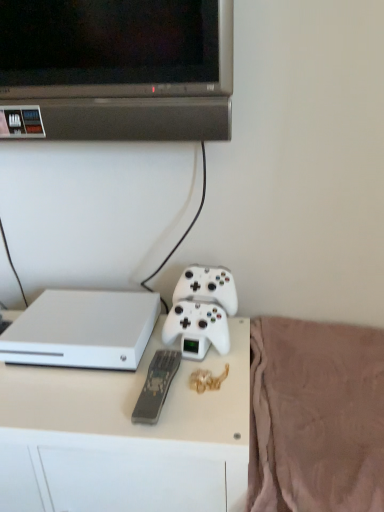
This screenshot has height=512, width=384. What are the coordinates of `free space to the right of gray matte remote at center` in the screenshot? It's located at (213, 392).